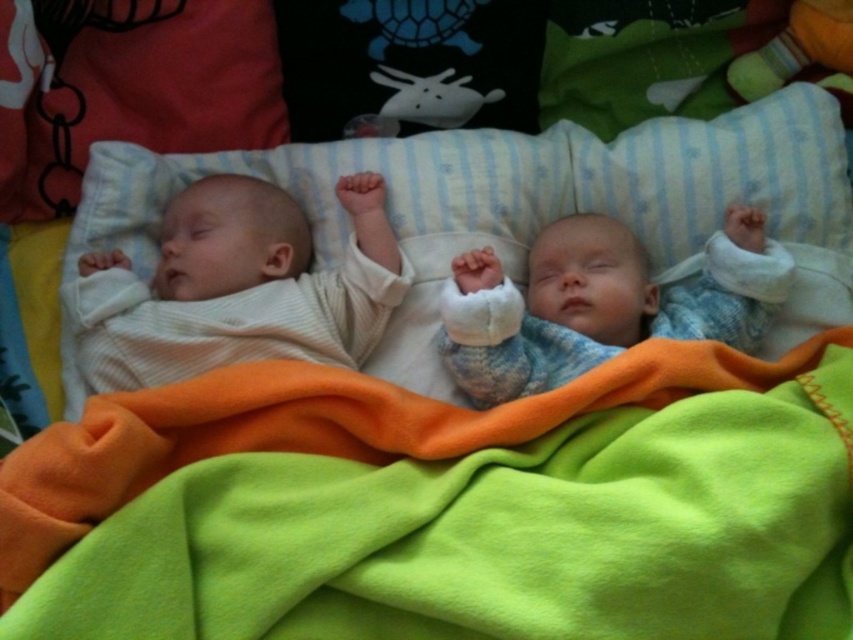
Question: Is green fleece blanket at lower center wider than knitted blue sweater at center?

Choices:
 (A) no
 (B) yes

Answer: (B)

Question: Which is nearer to the white ribbed fabric baby at left?

Choices:
 (A) knitted blue sweater at center
 (B) green fleece blanket at lower center

Answer: (B)

Question: Can you confirm if green fleece blanket at lower center is positioned below knitted blue sweater at center?

Choices:
 (A) yes
 (B) no

Answer: (A)

Question: Which object appears farthest from the camera in this image?

Choices:
 (A) green fleece blanket at lower center
 (B) white ribbed fabric baby at left
 (C) knitted blue sweater at center

Answer: (B)

Question: Is green fleece blanket at lower center above knitted blue sweater at center?

Choices:
 (A) yes
 (B) no

Answer: (B)

Question: Which object is positioned closest to the white ribbed fabric baby at left?

Choices:
 (A) green fleece blanket at lower center
 (B) knitted blue sweater at center

Answer: (A)